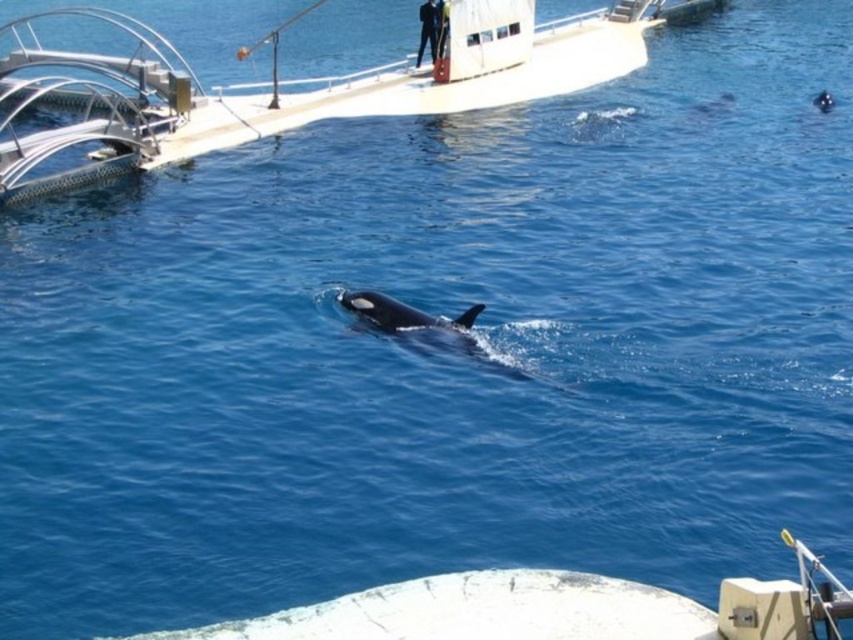
Question: Where is white glossy boat at upper center located in relation to black smooth whale at center in the image?

Choices:
 (A) left
 (B) right

Answer: (A)

Question: Can you confirm if white glossy boat at upper center is positioned to the right of black smooth whale at center?

Choices:
 (A) yes
 (B) no

Answer: (B)

Question: Which point appears farthest from the camera in this image?

Choices:
 (A) (635, 12)
 (B) (405, 314)

Answer: (A)

Question: Which object is closer to the camera taking this photo?

Choices:
 (A) white glossy boat at upper center
 (B) black smooth whale at center

Answer: (B)

Question: Does white glossy boat at upper center have a smaller size compared to black smooth whale at center?

Choices:
 (A) yes
 (B) no

Answer: (B)